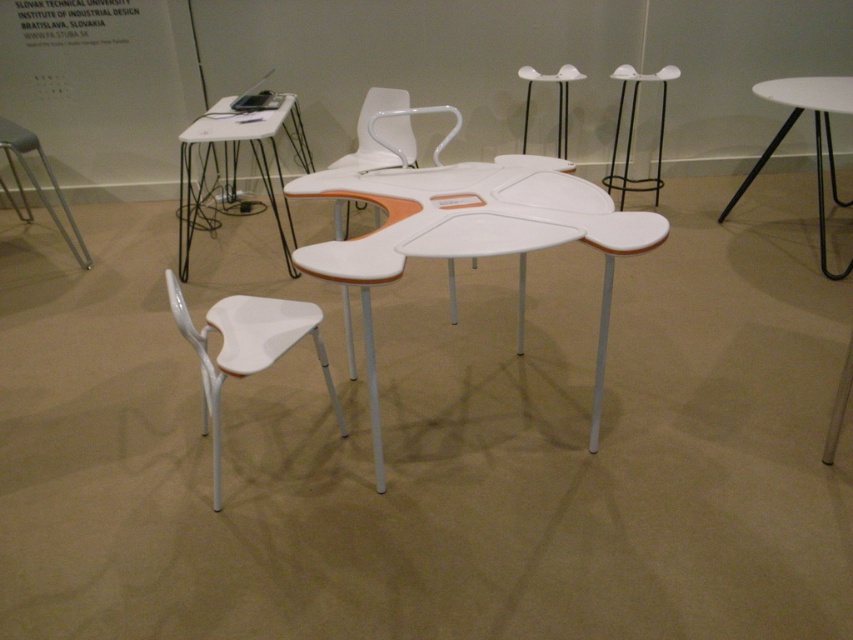
You are standing in front of the modern furniture display. You notice two points marked in the image, one at coordinates point (x=415, y=225) and another at point (x=390, y=154). Which of these points is nearer to your current position?

Point (x=415, y=225) is closer to the camera than point (x=390, y=154), so the point at coordinates point (x=415, y=225) is nearer to your current position.

You are standing in the exhibition hall and want to take a photo of the white glossy table at upper right. If your camera has a maximum focus range of 10 feet, will it be able to capture the table clearly?

The white glossy table at upper right is 9.84 feet from the camera, which is within the maximum focus range of 10 feet. Therefore, the camera can capture the table clearly.